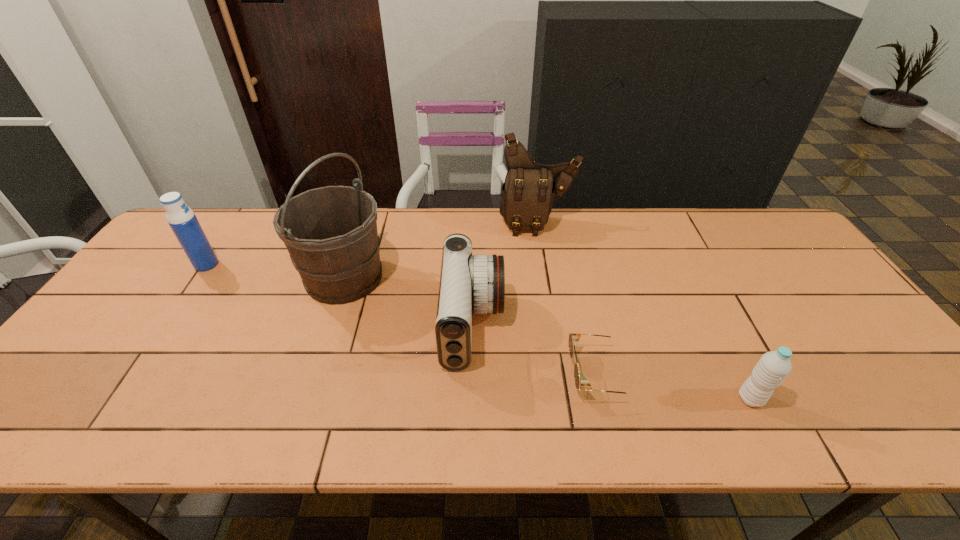
Find the location of a particular element. bucket is located at coordinates (330, 232).

Image resolution: width=960 pixels, height=540 pixels. Find the location of `the fifth object from right to left`. the fifth object from right to left is located at coordinates (330, 232).

The width and height of the screenshot is (960, 540). I want to click on the fifth shortest object, so (527, 195).

You are a GUI agent. You are given a task and a screenshot of the screen. Output one action in this format:
    pyautogui.click(x=<x>, y=<y>)
    Task: Click on the shoulder bag
    
    Given the screenshot: What is the action you would take?
    pyautogui.click(x=527, y=195)

Where is `the leftmost object`? This screenshot has width=960, height=540. the leftmost object is located at coordinates (182, 220).

Where is `the farther water bottle`? The image size is (960, 540). the farther water bottle is located at coordinates (182, 220).

Locate an element on the screen. The height and width of the screenshot is (540, 960). the third object from left to right is located at coordinates (469, 284).

This screenshot has width=960, height=540. I want to click on the nearer water bottle, so click(773, 367).

Locate an element on the screen. the right water bottle is located at coordinates (773, 367).

At what (x,y) coordinates should I click in order to perform the action: click on sunglasses. Please return your answer as a coordinate pair (x, y). The image size is (960, 540). Looking at the image, I should click on (573, 337).